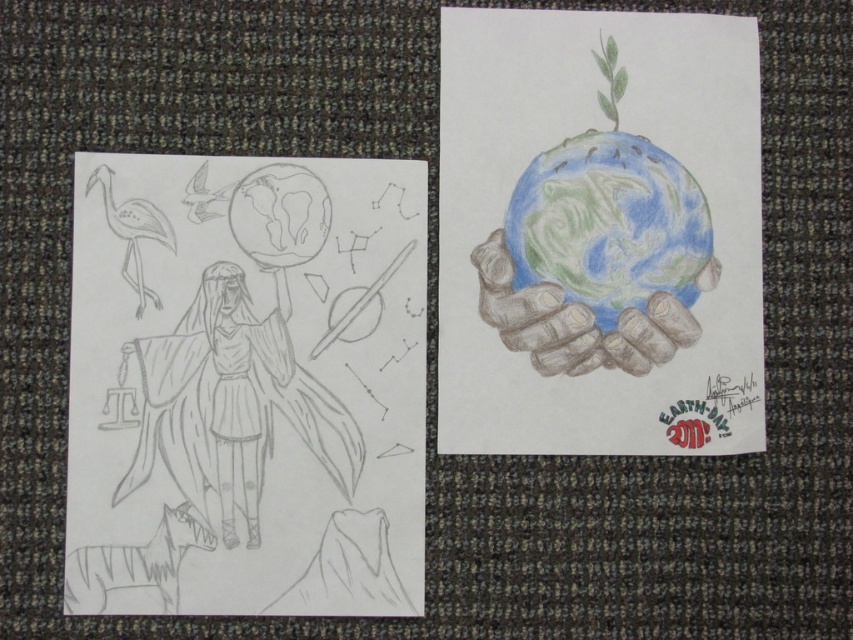
Describe the element at coordinates (247, 385) in the screenshot. I see `pencil sketch of figure holding globe at center` at that location.

Between pencil sketch of figure holding globe at center and pastel colored globe at center, which one is positioned higher?

pastel colored globe at center is higher up.

This screenshot has width=853, height=640. Identify the location of pencil sketch of figure holding globe at center. (247, 385).

In the scene shown: Who is more distant from viewer, (556, 154) or (677, 330)?

Positioned behind is point (556, 154).

Who is shorter, pastel colored globe at center or colored pencil hands at center?

Standing shorter between the two is colored pencil hands at center.

This screenshot has height=640, width=853. Identify the location of pastel colored globe at center. (608, 225).

Does pencil sketch of figure holding globe at center have a greater height compared to colored pencil hands at center?

Correct, pencil sketch of figure holding globe at center is much taller as colored pencil hands at center.

Between point (149, 538) and point (631, 362), which one is positioned in front?

Point (149, 538) is in front.

Where is `pencil sketch of figure holding globe at center`? Image resolution: width=853 pixels, height=640 pixels. pencil sketch of figure holding globe at center is located at coordinates (247, 385).